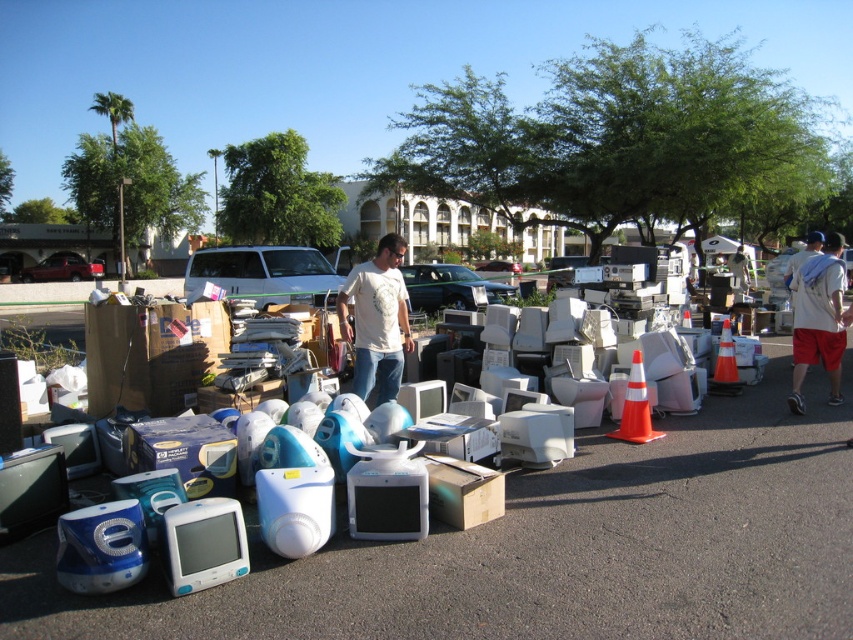
You are standing in the e waste sorting area and need to locate two specific points marked in the image. The first point is at coordinates point (363, 312) and the second is at point (837, 244). Which of these two points is closer to your current position?

Point (363, 312) is closer to the viewer than point (837, 244), so the first point is closer.